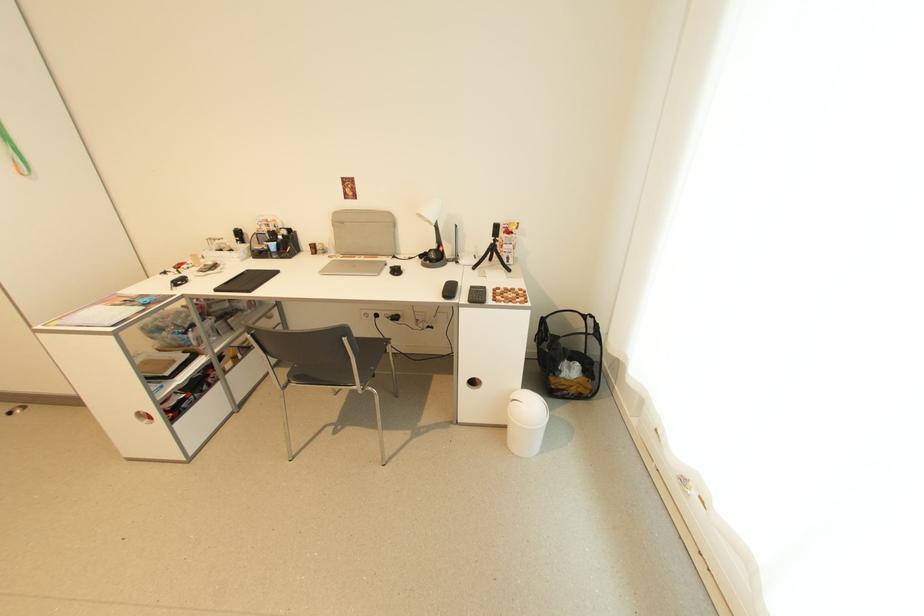
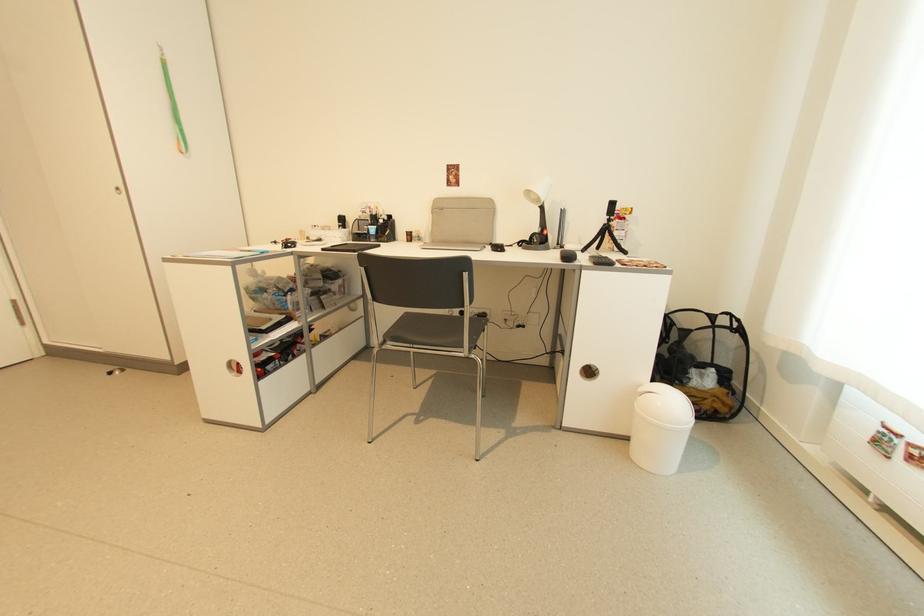
The images are taken continuously from a first-person perspective. In which direction are you moving?

The cameraman walked toward left, forward.